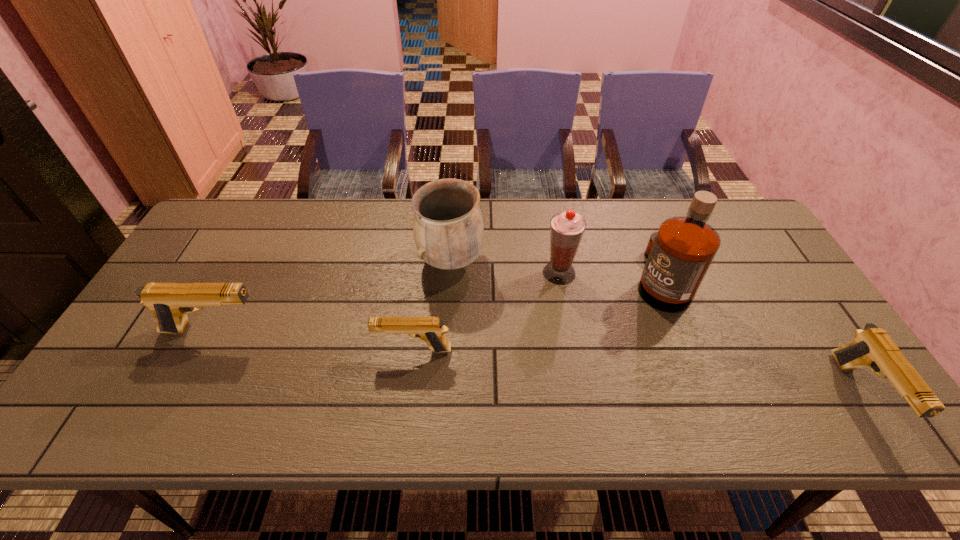
The width and height of the screenshot is (960, 540). I want to click on unoccupied area between the urn and the leftmost pistol, so click(332, 296).

What are the coordinates of `unoccupied position between the fourth object from left to right and the leftmost pistol` in the screenshot? It's located at (387, 302).

Locate an element on the screen. This screenshot has width=960, height=540. vacant area between the rightmost object and the urn is located at coordinates (656, 328).

What are the coordinates of `vacant space that's between the fourth object from left to right and the urn` in the screenshot? It's located at pos(505,267).

This screenshot has height=540, width=960. I want to click on vacant region between the third object from right to left and the third nearest object, so click(387, 302).

Locate an element on the screen. free spot between the second object from right to left and the leftmost object is located at coordinates (437, 305).

The height and width of the screenshot is (540, 960). Identify the location of free space that is in between the smoothie and the shortest pistol. (487, 312).

At what (x,y) coordinates should I click in order to perform the action: click on blank region between the urn and the leftmost pistol. Please return your answer as a coordinate pair (x, y). Looking at the image, I should click on (332, 296).

The image size is (960, 540). I want to click on free space between the shortest object and the urn, so click(x=432, y=306).

You are a GUI agent. You are given a task and a screenshot of the screen. Output one action in this format:
    pyautogui.click(x=<x>, y=<y>)
    Task: Click on the object that stands as the fifth closest to the shortest object
    The height and width of the screenshot is (540, 960).
    Given the screenshot: What is the action you would take?
    pyautogui.click(x=872, y=347)